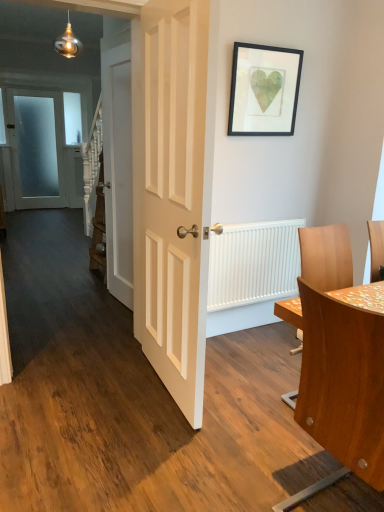
Question: Is white ribbed radiator at right wider or thinner than wooden table at right?

Choices:
 (A) thin
 (B) wide

Answer: (A)

Question: Considering their positions, is white ribbed radiator at right located in front of or behind wooden table at right?

Choices:
 (A) behind
 (B) front

Answer: (A)

Question: Which is nearer to the white wooden door at center, arranged as the 2th door when viewed from the right?

Choices:
 (A) white ribbed radiator at right
 (B) white glossy door at center, the 3th door viewed from the left
 (C) frosted glass door at left, marked as the third door in a front-to-back arrangement
 (D) wooden table at right
 (E) black matte picture frame at upper center

Answer: (B)

Question: Considering the real-world distances, which object is closest to the white ribbed radiator at right?

Choices:
 (A) black matte picture frame at upper center
 (B) white wooden door at center, arranged as the 2th door when viewed from the right
 (C) frosted glass door at left, the 3th door in the right-to-left sequence
 (D) white glossy door at center, the third door from the back
 (E) wooden table at right

Answer: (D)